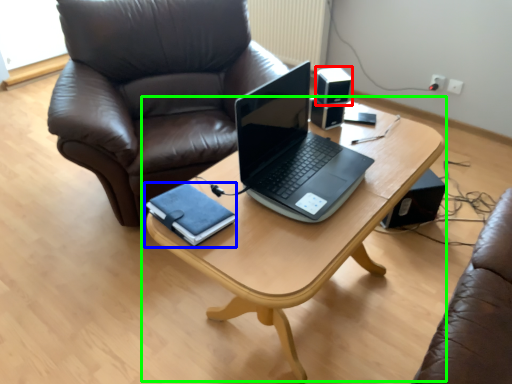
Question: Which object is the farthest from speaker (highlighted by a red box)? Choose among these: notebook (highlighted by a blue box) or table (highlighted by a green box).

Choices:
 (A) notebook
 (B) table

Answer: (A)